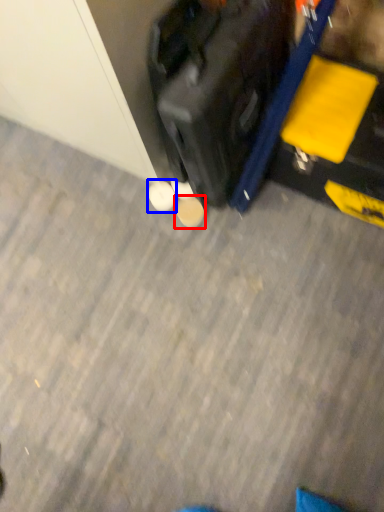
Question: Which object is further to the camera taking this photo, footwear (highlighted by a red box) or footwear (highlighted by a blue box)?

Choices:
 (A) footwear
 (B) footwear

Answer: (B)